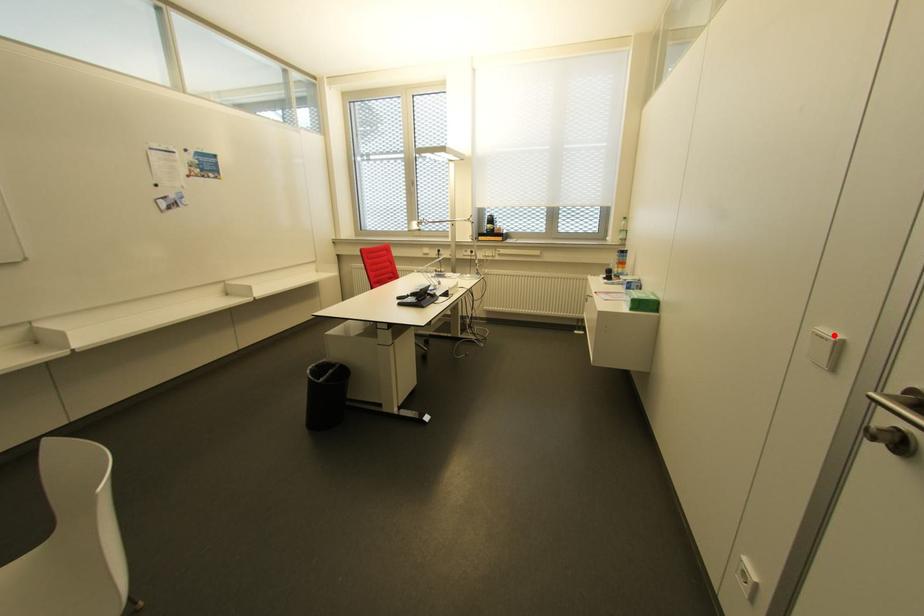
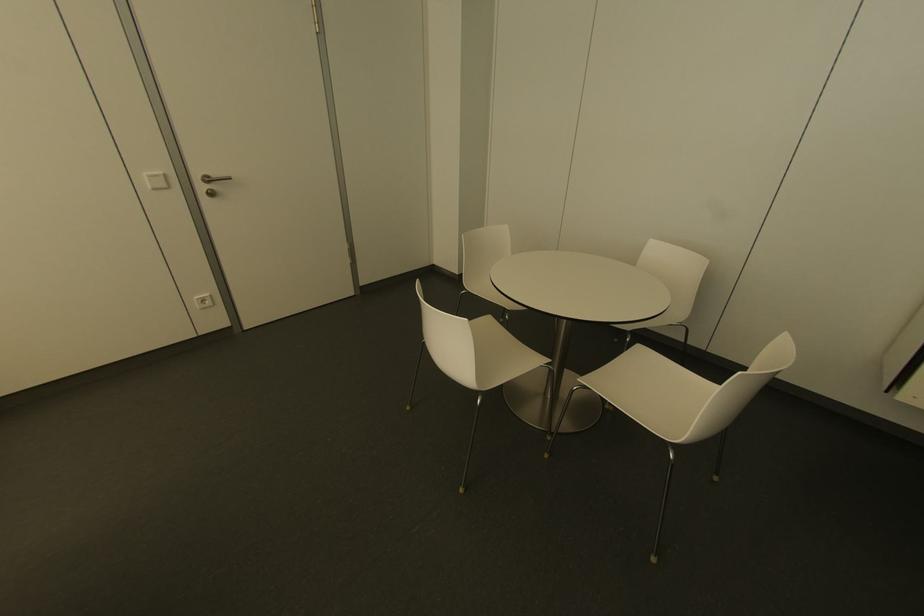
Find the pixel in the second image that matches the highlighted location in the first image.

(159, 172)